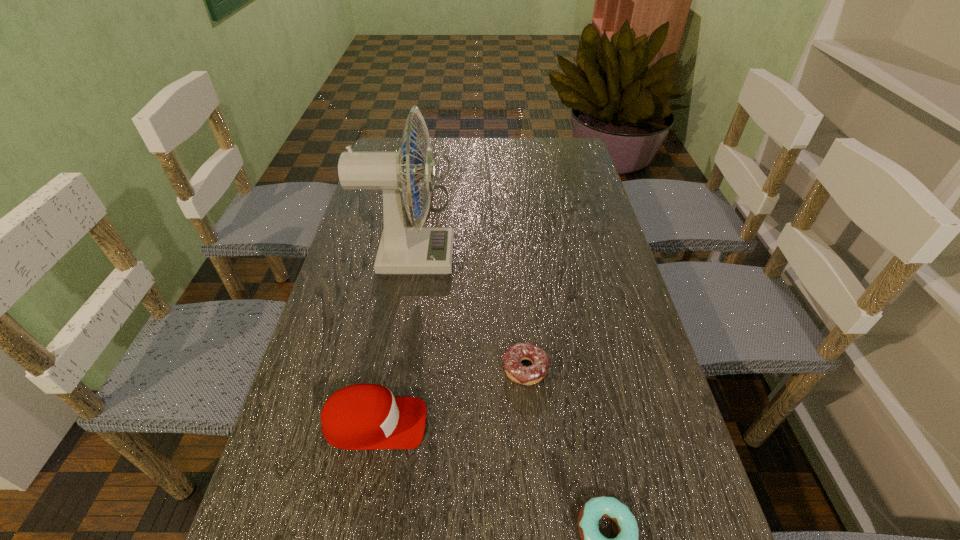
The height and width of the screenshot is (540, 960). Identify the location of fan. (402, 250).

This screenshot has width=960, height=540. I want to click on the tallest object, so click(402, 250).

Locate an element on the screen. This screenshot has width=960, height=540. mug is located at coordinates (438, 153).

The height and width of the screenshot is (540, 960). Find the location of `the farthest object`. the farthest object is located at coordinates (438, 153).

This screenshot has height=540, width=960. Find the location of `the third shortest object`. the third shortest object is located at coordinates (362, 416).

Locate an element on the screen. the second nearest object is located at coordinates (362, 416).

What are the coordinates of `the taller doughnut` in the screenshot? It's located at (527, 375).

Locate an element on the screen. the second object from right to left is located at coordinates (527, 375).

Locate an element on the screen. vacant space located 0.390m on the front-facing side of the fourth nearest object is located at coordinates (597, 258).

Locate an element on the screen. vacant space located on the side of the fourth shortest object with the handle is located at coordinates (571, 183).